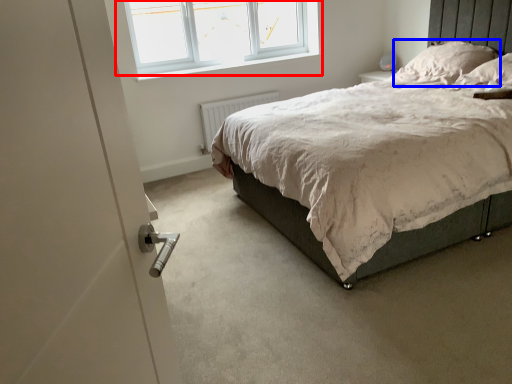
Question: Among these objects, which one is nearest to the camera, window (highlighted by a red box) or pillow (highlighted by a blue box)?

Choices:
 (A) window
 (B) pillow

Answer: (B)